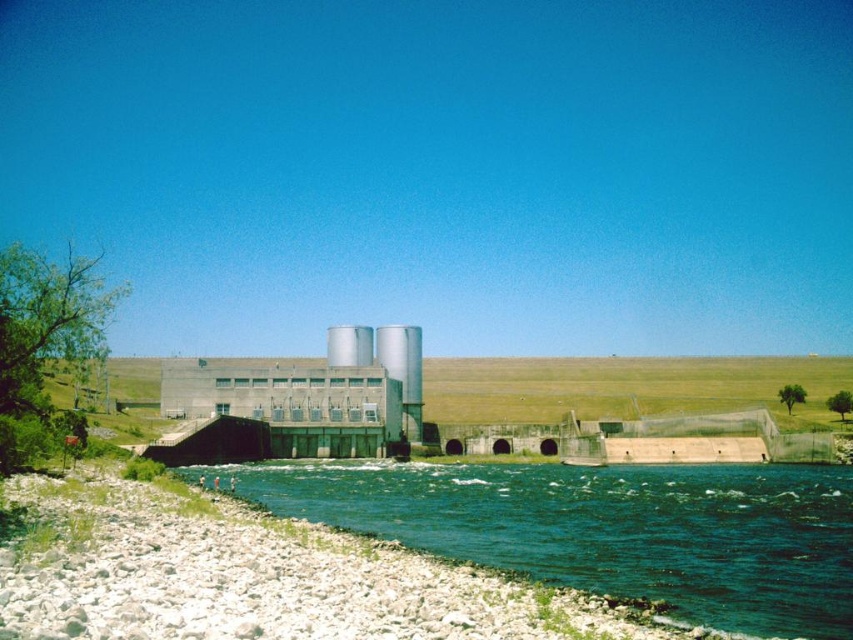
You are a construction worker assigned to paint both the concrete gray power station at center and the silver metallic silo at center. Given that you have enough paint for only one of them, which structure should you prioritize based on their sizes?

The concrete gray power station at center is larger in size than the silver metallic silo at center, so you should prioritize painting the concrete gray power station at center first since it requires more paint.

You are standing at the base of the dam and want to reach the point marked at coordinates point(669, 525). However, there is an obstacle located at point(329, 348). Which point is closer to your current position?

Point(669, 525) is closer to the viewer than point(329, 348), so the point you want to reach is closer to you than the obstacle.

You are a photographer standing at the base of the dam. You want to capture a shot of the point at coordinates point [721,516]. If your camera has a maximum focus range of 70 meters, will you be able to focus on that point?

The distance of point [721,516] from the camera is 73.29 meters, which exceeds the camera maximum focus range of 70 meters. Therefore, the camera cannot focus on that point.